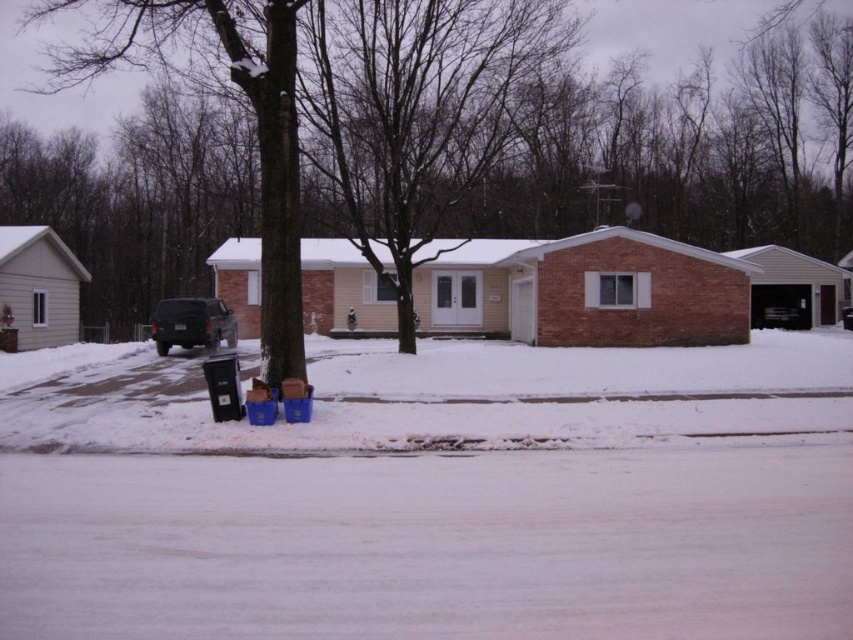
You are a delivery person trying to park your delivery van, which is 2 meters wide, in the residential area shown. Can you park your van between the white powdery snow at lower center and the matte black suv at center without overlapping them?

The white powdery snow at lower center has a larger width than the matte black suv at center. Since the snow is wider, there might be enough space between them to park the van. However, the exact distance isn

You are driving a delivery van and need to park your vehicle on the driveway near the house with a brick facade and beige siding. The driveway has a matte black suv at center. There is white powdery snow at lower center. Where should you park your delivery van?

You should park the delivery van behind the matte black suv at center because the white powdery snow at lower center is located below it, indicating there is space behind the suv to park without disturbing the snow.

You are a delivery person needing to park your vehicle in this neighborhood. You see the white powdery snow at lower center and the matte black suv at center. How far apart are these two objects?

The white powdery snow at lower center and the matte black suv at center are 42.65 feet apart.